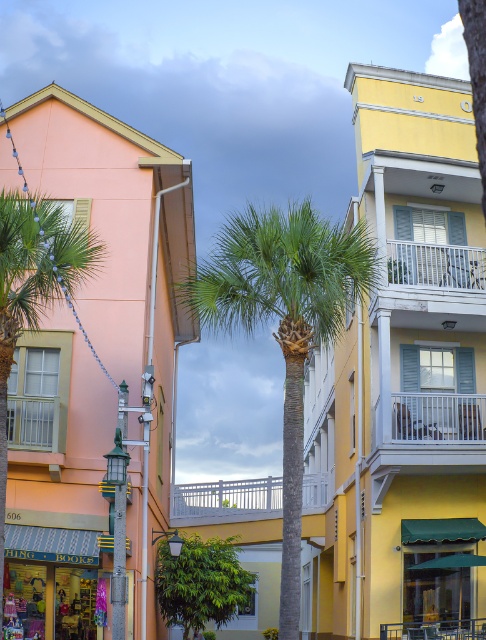
Question: Can you confirm if green leafy palm tree at center is thinner than green leafy palm tree at left?

Choices:
 (A) yes
 (B) no

Answer: (B)

Question: Considering the relative positions of matte pink building at left and white painted wood balcony at upper right in the image provided, where is matte pink building at left located with respect to white painted wood balcony at upper right?

Choices:
 (A) left
 (B) right

Answer: (A)

Question: Which point is closer to the camera?

Choices:
 (A) (410, 396)
 (B) (387, 246)
 (C) (215, 538)
 (D) (0, 465)

Answer: (D)

Question: Estimate the real-world distances between objects in this image. Which object is closer to the matte pink building at left?

Choices:
 (A) green leafy palm tree at center
 (B) white painted wood balcony at center
 (C) green leafy palm tree at left

Answer: (C)

Question: Which of the following is the farthest from the observer?

Choices:
 (A) (215, 493)
 (B) (392, 412)

Answer: (A)

Question: Is matte pink building at left above white painted wood balcony at center?

Choices:
 (A) no
 (B) yes

Answer: (B)